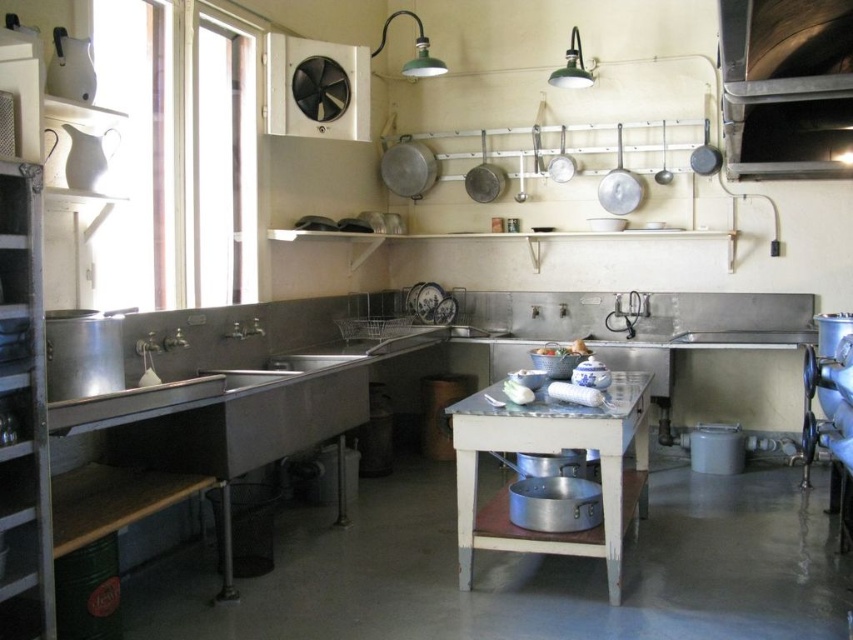
Question: Which of the following is the farthest from the observer?

Choices:
 (A) metallic silver table at center
 (B) metallic silver exhaust hood at upper right

Answer: (A)

Question: Can you confirm if metallic silver exhaust hood at upper right is positioned below metallic silver table at center?

Choices:
 (A) yes
 (B) no

Answer: (B)

Question: Does metallic silver exhaust hood at upper right have a larger size compared to metallic silver table at center?

Choices:
 (A) yes
 (B) no

Answer: (A)

Question: Is metallic silver exhaust hood at upper right wider than metallic silver table at center?

Choices:
 (A) yes
 (B) no

Answer: (A)